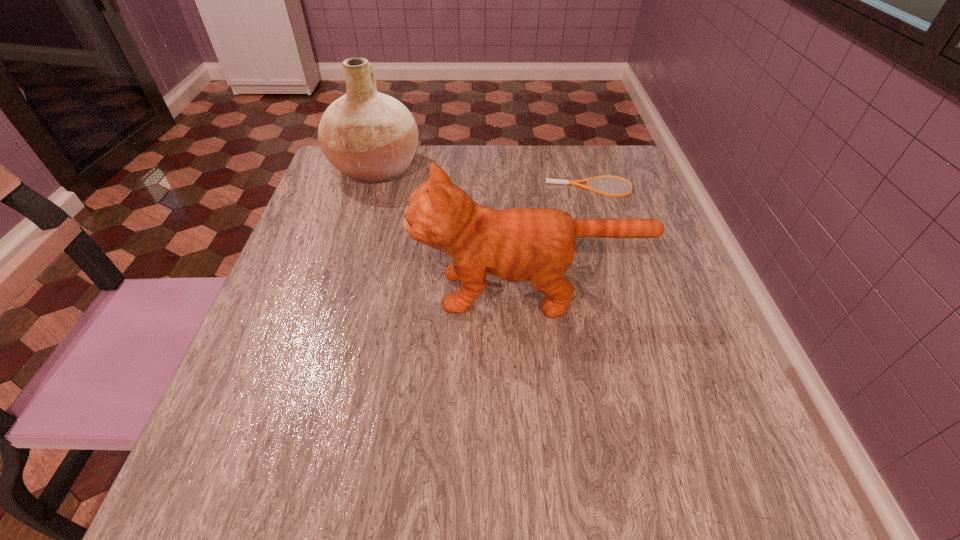
Where is `vacant space at the far right corner of the desktop`? The height and width of the screenshot is (540, 960). vacant space at the far right corner of the desktop is located at coordinates (628, 165).

Identify the location of vacant point located between the pottery and the shortest object. Image resolution: width=960 pixels, height=540 pixels. (482, 178).

This screenshot has width=960, height=540. I want to click on free space between the shortest object and the leftmost object, so click(482, 178).

Locate an element on the screen. This screenshot has width=960, height=540. free spot between the leftmost object and the tennis racket is located at coordinates pos(482,178).

Image resolution: width=960 pixels, height=540 pixels. Find the location of `the second closest object to the leftmost object`. the second closest object to the leftmost object is located at coordinates (554, 181).

The width and height of the screenshot is (960, 540). Identify the location of object that is the second closest to the nearest object. (371, 137).

Image resolution: width=960 pixels, height=540 pixels. I want to click on free spot that satisfies the following two spatial constraints: 1. to pour from the handle of the pottery; 2. on the right side of the tennis racket, so click(370, 187).

The image size is (960, 540). I want to click on free space that satisfies the following two spatial constraints: 1. to pour from the handle of the leftmost object; 2. on the left side of the tennis racket, so click(370, 187).

This screenshot has height=540, width=960. What are the coordinates of `free location that satisfies the following two spatial constraints: 1. to pour from the handle of the shortest object; 2. on the left side of the leftmost object` in the screenshot? It's located at (370, 187).

Find the location of a particular element. free space that satisfies the following two spatial constraints: 1. on the front side of the shortest object; 2. on the face of the nearest object is located at coordinates click(x=619, y=292).